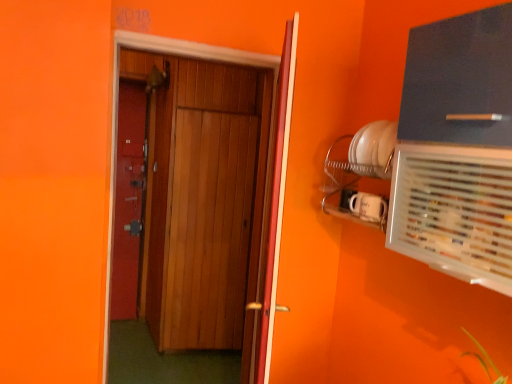
Question: From the image's perspective, is clear plastic air conditioning at upper right located above wooden door at center, marked as the 2th door in a right-to-left arrangement?

Choices:
 (A) yes
 (B) no

Answer: (A)

Question: Is clear plastic air conditioning at upper right bigger than wooden door at center, marked as the 2th door in a right-to-left arrangement?

Choices:
 (A) no
 (B) yes

Answer: (A)

Question: Are clear plastic air conditioning at upper right and wooden door at center, the 1th door viewed from the left, beside each other?

Choices:
 (A) yes
 (B) no

Answer: (B)

Question: Would you say wooden door at center, the 1th door viewed from the left, is part of clear plastic air conditioning at upper right's contents?

Choices:
 (A) no
 (B) yes

Answer: (A)

Question: Can you confirm if clear plastic air conditioning at upper right is smaller than wooden door at center, the 1th door viewed from the left?

Choices:
 (A) yes
 (B) no

Answer: (A)

Question: From a real-world perspective, is clear plastic air conditioning at upper right positioned over wooden door at center, the 1th door viewed from the left, based on gravity?

Choices:
 (A) no
 (B) yes

Answer: (B)

Question: Are wooden door at center, marked as the 2th door in a right-to-left arrangement, and wooden door at center, placed as the second door when sorted from left to right, located far from each other?

Choices:
 (A) no
 (B) yes

Answer: (B)

Question: Is wooden door at center, the 1th door viewed from the left, to the left of wooden door at center, placed as the second door when sorted from left to right, from the viewer's perspective?

Choices:
 (A) no
 (B) yes

Answer: (B)

Question: Is wooden door at center, the 1th door viewed from the left, positioned with its back to wooden door at center, the 1th door viewed from the right?

Choices:
 (A) yes
 (B) no

Answer: (A)

Question: From the image's perspective, is wooden door at center, the 1th door viewed from the left, over wooden door at center, placed as the second door when sorted from left to right?

Choices:
 (A) no
 (B) yes

Answer: (B)

Question: From the image's perspective, is wooden door at center, the 1th door viewed from the left, located beneath wooden door at center, placed as the second door when sorted from left to right?

Choices:
 (A) no
 (B) yes

Answer: (A)

Question: Is wooden door at center, the 1th door viewed from the left, not within wooden door at center, placed as the second door when sorted from left to right?

Choices:
 (A) no
 (B) yes

Answer: (B)

Question: Is clear plastic air conditioning at upper right located outside wooden door at center, placed as the second door when sorted from left to right?

Choices:
 (A) no
 (B) yes

Answer: (B)